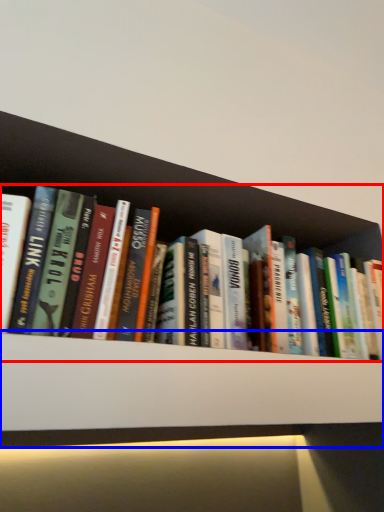
Question: Which object is further to the camera taking this photo, book (highlighted by a red box) or shelf (highlighted by a blue box)?

Choices:
 (A) book
 (B) shelf

Answer: (A)